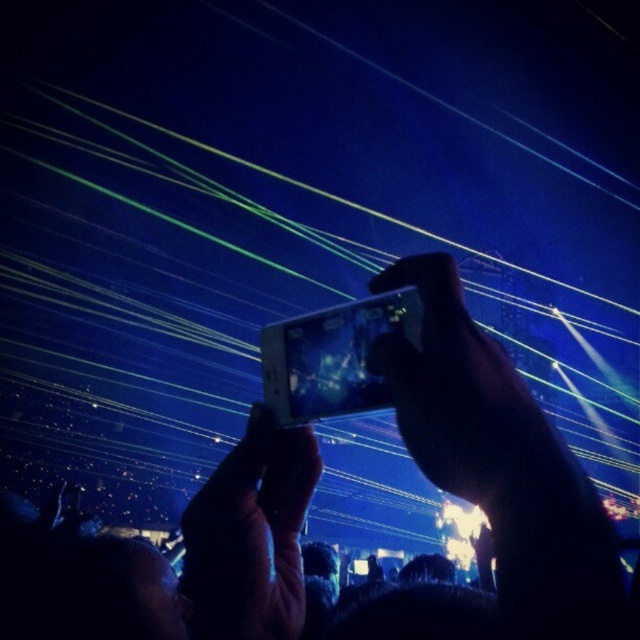
Question: Is matte black phone at center further to camera compared to black matte phone at center?

Choices:
 (A) no
 (B) yes

Answer: (A)

Question: In this image, where is matte black phone at center located relative to black matte phone at center?

Choices:
 (A) right
 (B) left

Answer: (A)

Question: Which of the following is the closest to the observer?

Choices:
 (A) black matte phone at center
 (B) matte black phone at center

Answer: (B)

Question: Can you confirm if matte black phone at center is positioned to the left of black matte phone at center?

Choices:
 (A) yes
 (B) no

Answer: (B)